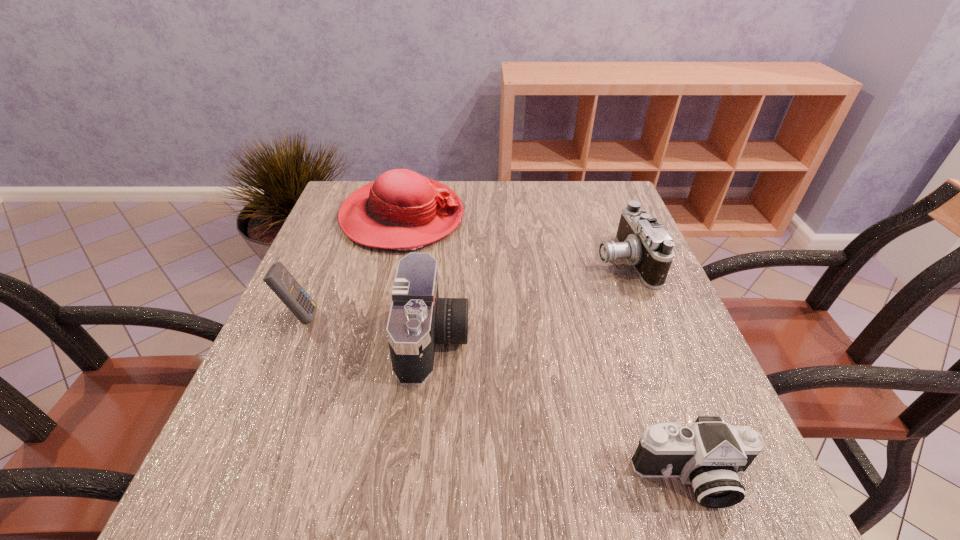
I want to click on hat, so click(402, 210).

This screenshot has width=960, height=540. Find the location of `the leftmost camera`. the leftmost camera is located at coordinates click(418, 320).

Image resolution: width=960 pixels, height=540 pixels. I want to click on calculator, so click(x=278, y=278).

This screenshot has height=540, width=960. I want to click on the farthest camera, so click(x=641, y=240).

Image resolution: width=960 pixels, height=540 pixels. I want to click on the nearest object, so click(710, 455).

Where is `vacant space located at the front of the hat with a bow`? vacant space located at the front of the hat with a bow is located at coordinates (524, 217).

Find the location of a particular element. The height and width of the screenshot is (540, 960). vacant space located 0.330m on the front-facing side of the second nearest camera is located at coordinates (640, 339).

The image size is (960, 540). Find the location of `blank area located 0.280m on the front-facing side of the calculator`. blank area located 0.280m on the front-facing side of the calculator is located at coordinates (456, 316).

Locate an element on the screen. Image resolution: width=960 pixels, height=540 pixels. blank space located at the lens of the farthest camera is located at coordinates (423, 260).

This screenshot has height=540, width=960. What are the coordinates of `free space located at the lens of the farthest camera` in the screenshot? It's located at (475, 260).